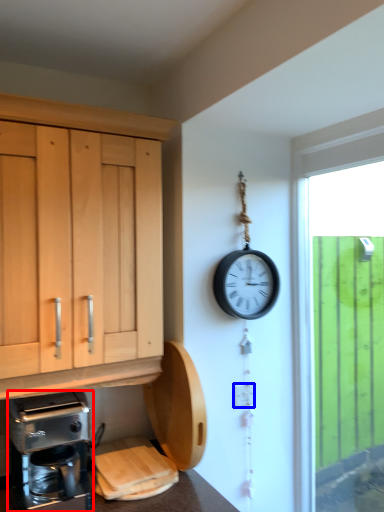
Question: Which object is further to the camera taking this photo, coffee maker (highlighted by a red box) or electric outlet (highlighted by a blue box)?

Choices:
 (A) coffee maker
 (B) electric outlet

Answer: (B)